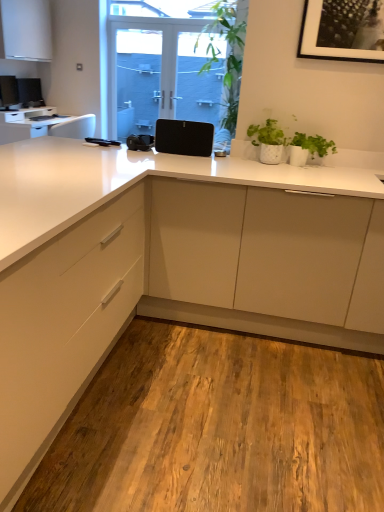
Question: From a real-world perspective, is black matte picture frame at upper right physically located above or below green leafy plant at upper center?

Choices:
 (A) below
 (B) above

Answer: (B)

Question: Do you think black matte picture frame at upper right is within green leafy plant at upper center, or outside of it?

Choices:
 (A) outside
 (B) inside

Answer: (A)

Question: Which of these objects is positioned farthest from the satin black screen door at center, which ranks as the second screen door in right-to-left order?

Choices:
 (A) white glossy countertop at upper left, marked as the first countertop in a top-to-bottom arrangement
 (B) black matte speaker at center
 (C) black matte picture frame at upper right
 (D) white matte drawer at center
 (E) green matte plant at upper right, the first houseplant in the right-to-left sequence

Answer: (D)

Question: Considering the real-world distances, which object is farthest from the white glossy countertop at center, which is the first countertop in bottom-to-top order?

Choices:
 (A) green leafy plant at upper center
 (B) satin black screen door at center, which appears as the first screen door when viewed from the left
 (C) black matte speaker at center
 (D) green matte plant at upper right, the first houseplant in the right-to-left sequence
 (E) white matte drawer at center

Answer: (B)